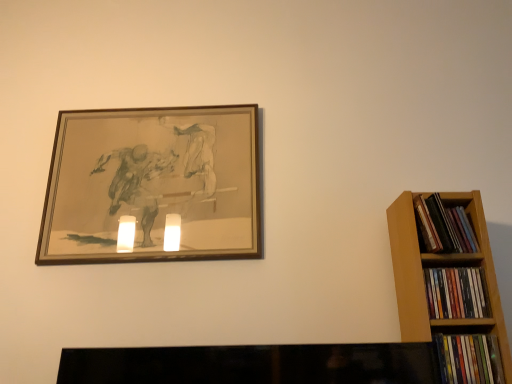
At what (x,y) coordinates should I click in order to perform the action: click on multicolored paperbacks at right, placed as the first book when sorted from top to bottom. Please return your answer as a coordinate pair (x, y). The height and width of the screenshot is (384, 512). Looking at the image, I should click on (444, 226).

In order to face multicolored paperbacks at right, the third book ordered from the bottom, should I rotate leftwards or rightwards?

To face it directly, rotate right by 24.654 degrees.

Describe the element at coordinates (469, 359) in the screenshot. I see `multicolored plastic books at right, which is the third book in top-to-bottom order` at that location.

Find the location of a particular element. multicolored paperbacks at right, the second book in the bottom-to-top sequence is located at coordinates (456, 293).

What's the angular difference between multicolored plastic books at right, placed as the 1th book when sorted from bottom to top, and multicolored paperbacks at right, the second book in the bottom-to-top sequence,'s facing directions?

The facing directions of multicolored plastic books at right, placed as the 1th book when sorted from bottom to top, and multicolored paperbacks at right, the second book in the bottom-to-top sequence, are 0.00781 degrees apart.

In the scene shown: From a real-world perspective, which object stands above the other?

From a 3D spatial view, multicolored paperbacks at right, the second book in the bottom-to-top sequence, is above.

Is multicolored plastic books at right, which is the third book in top-to-bottom order, situated inside multicolored paperbacks at right, the second book in the bottom-to-top sequence, or outside?

multicolored plastic books at right, which is the third book in top-to-bottom order, is not enclosed by multicolored paperbacks at right, the second book in the bottom-to-top sequence.

From the image's perspective, which is below, multicolored plastic books at right, which is the third book in top-to-bottom order, or multicolored paperbacks at right, the second book in the bottom-to-top sequence?

From the image's view, multicolored plastic books at right, which is the third book in top-to-bottom order, is below.

Is multicolored plastic books at right, placed as the 1th book when sorted from bottom to top, oriented towards multicolored paperbacks at right, placed as the first book when sorted from top to bottom?

No, multicolored plastic books at right, placed as the 1th book when sorted from bottom to top, is not aimed at multicolored paperbacks at right, placed as the first book when sorted from top to bottom.

Looking at this image, from the image's perspective, is multicolored plastic books at right, placed as the 1th book when sorted from bottom to top, above or below multicolored paperbacks at right, the third book ordered from the bottom?

multicolored plastic books at right, placed as the 1th book when sorted from bottom to top, is situated lower than multicolored paperbacks at right, the third book ordered from the bottom, in the image.

Does multicolored plastic books at right, which is the third book in top-to-bottom order, have a larger size compared to multicolored paperbacks at right, the third book ordered from the bottom?

Correct, multicolored plastic books at right, which is the third book in top-to-bottom order, is larger in size than multicolored paperbacks at right, the third book ordered from the bottom.

In the image, is multicolored plastic books at right, which is the third book in top-to-bottom order, positioned in front of or behind multicolored paperbacks at right, the third book ordered from the bottom?

multicolored plastic books at right, which is the third book in top-to-bottom order, is positioned closer to the viewer than multicolored paperbacks at right, the third book ordered from the bottom.

Looking at this image, does wooden picture frame at upper left contain multicolored paperbacks at right, placed as the first book when sorted from top to bottom?

Actually, multicolored paperbacks at right, placed as the first book when sorted from top to bottom, is outside wooden picture frame at upper left.

From a real-world perspective, which object rests below the other?

In real-world perspective, multicolored paperbacks at right, the third book ordered from the bottom, is lower.

Is wooden picture frame at upper left oriented towards multicolored paperbacks at right, the third book ordered from the bottom?

No, wooden picture frame at upper left is not turned towards multicolored paperbacks at right, the third book ordered from the bottom.

Is multicolored paperbacks at right, the third book ordered from the bottom, further to camera compared to wooden picture frame at upper left?

No, multicolored paperbacks at right, the third book ordered from the bottom, is in front of wooden picture frame at upper left.

From the wooden picture frame at upper left, count 2nd books forward and point to it. Please provide its 2D coordinates.

[(456, 293)]

How distant is multicolored paperbacks at right, the second book in the bottom-to-top sequence, from wooden picture frame at upper left?

32.73 inches.

Considering the relative sizes of multicolored paperbacks at right, the second book in the bottom-to-top sequence, and wooden picture frame at upper left in the image provided, is multicolored paperbacks at right, the second book in the bottom-to-top sequence, bigger than wooden picture frame at upper left?

Actually, multicolored paperbacks at right, the second book in the bottom-to-top sequence, might be smaller than wooden picture frame at upper left.

Which point is more forward, (463, 271) or (253, 186)?

The point (463, 271) is more forward.

From a real-world perspective, is multicolored plastic books at right, which is the third book in top-to-bottom order, physically above wooden picture frame at upper left?

No, from a real-world perspective, multicolored plastic books at right, which is the third book in top-to-bottom order, is not on top of wooden picture frame at upper left.

Measure the distance between multicolored plastic books at right, which is the third book in top-to-bottom order, and wooden picture frame at upper left.

multicolored plastic books at right, which is the third book in top-to-bottom order, is 35.64 inches away from wooden picture frame at upper left.

The height and width of the screenshot is (384, 512). Find the location of `the 3rd book in front of the wooden picture frame at upper left`. the 3rd book in front of the wooden picture frame at upper left is located at coordinates (469, 359).

Is multicolored plastic books at right, placed as the 1th book when sorted from bottom to top, far away from wooden picture frame at upper left?

That's not correct — multicolored plastic books at right, placed as the 1th book when sorted from bottom to top, is a little close to wooden picture frame at upper left.

Which is less distant, [477,279] or [487,382]?

Point [477,279].

Is multicolored paperbacks at right, arranged as the second book when viewed from the top, at the right side of multicolored plastic books at right, which is the third book in top-to-bottom order?

Incorrect, multicolored paperbacks at right, arranged as the second book when viewed from the top, is not on the right side of multicolored plastic books at right, which is the third book in top-to-bottom order.

How much distance is there between multicolored paperbacks at right, arranged as the second book when viewed from the top, and multicolored plastic books at right, which is the third book in top-to-bottom order?

multicolored paperbacks at right, arranged as the second book when viewed from the top, is 3.95 inches from multicolored plastic books at right, which is the third book in top-to-bottom order.

From the image's perspective, which is above, multicolored paperbacks at right, the second book in the bottom-to-top sequence, or multicolored plastic books at right, placed as the 1th book when sorted from bottom to top?

multicolored paperbacks at right, the second book in the bottom-to-top sequence, from the image's perspective.

Which book is the 1st one when counting from the right side of the multicolored paperbacks at right, arranged as the second book when viewed from the top? Please provide its 2D coordinates.

[(469, 359)]

Identify the location of the 2nd book behind the multicolored plastic books at right, which is the third book in top-to-bottom order. This screenshot has width=512, height=384. (444, 226).

Based on their spatial positions, is multicolored plastic books at right, which is the third book in top-to-bottom order, or multicolored paperbacks at right, placed as the first book when sorted from top to bottom, further from multicolored paperbacks at right, the second book in the bottom-to-top sequence?

The object further to multicolored paperbacks at right, the second book in the bottom-to-top sequence, is multicolored paperbacks at right, placed as the first book when sorted from top to bottom.

Considering their positions, is wooden picture frame at upper left positioned closer to multicolored paperbacks at right, arranged as the second book when viewed from the top, than multicolored plastic books at right, which is the third book in top-to-bottom order?

multicolored plastic books at right, which is the third book in top-to-bottom order.

Which object lies nearer to the anchor point multicolored plastic books at right, which is the third book in top-to-bottom order, wooden picture frame at upper left or multicolored paperbacks at right, arranged as the second book when viewed from the top?

multicolored paperbacks at right, arranged as the second book when viewed from the top, lies closer to multicolored plastic books at right, which is the third book in top-to-bottom order, than the other object.

Considering their positions, is multicolored plastic books at right, placed as the 1th book when sorted from bottom to top, positioned closer to wooden picture frame at upper left than multicolored paperbacks at right, the second book in the bottom-to-top sequence?

The object closer to wooden picture frame at upper left is multicolored paperbacks at right, the second book in the bottom-to-top sequence.

Looking at this image, based on their spatial positions, is multicolored paperbacks at right, the second book in the bottom-to-top sequence, or multicolored paperbacks at right, the third book ordered from the bottom, closer to multicolored plastic books at right, placed as the 1th book when sorted from bottom to top?

multicolored paperbacks at right, the second book in the bottom-to-top sequence, lies closer to multicolored plastic books at right, placed as the 1th book when sorted from bottom to top, than the other object.

Which object lies further to the anchor point multicolored paperbacks at right, the second book in the bottom-to-top sequence, wooden picture frame at upper left or multicolored paperbacks at right, placed as the first book when sorted from top to bottom?

The object further to multicolored paperbacks at right, the second book in the bottom-to-top sequence, is wooden picture frame at upper left.

Looking at the image, which one is located further to multicolored paperbacks at right, the second book in the bottom-to-top sequence, multicolored plastic books at right, which is the third book in top-to-bottom order, or wooden picture frame at upper left?

Based on the image, wooden picture frame at upper left appears to be further to multicolored paperbacks at right, the second book in the bottom-to-top sequence.

When comparing their distances from multicolored plastic books at right, placed as the 1th book when sorted from bottom to top, does multicolored paperbacks at right, the third book ordered from the bottom, or wooden picture frame at upper left seem closer?

Based on the image, multicolored paperbacks at right, the third book ordered from the bottom, appears to be nearer to multicolored plastic books at right, placed as the 1th book when sorted from bottom to top.

Identify the location of book that lies between multicolored paperbacks at right, the third book ordered from the bottom, and multicolored plastic books at right, which is the third book in top-to-bottom order, from top to bottom. (456, 293).

This screenshot has width=512, height=384. Find the location of `book located between wooden picture frame at upper left and multicolored plastic books at right, placed as the 1th book when sorted from bottom to top, in the left-right direction`. book located between wooden picture frame at upper left and multicolored plastic books at right, placed as the 1th book when sorted from bottom to top, in the left-right direction is located at coordinates click(456, 293).